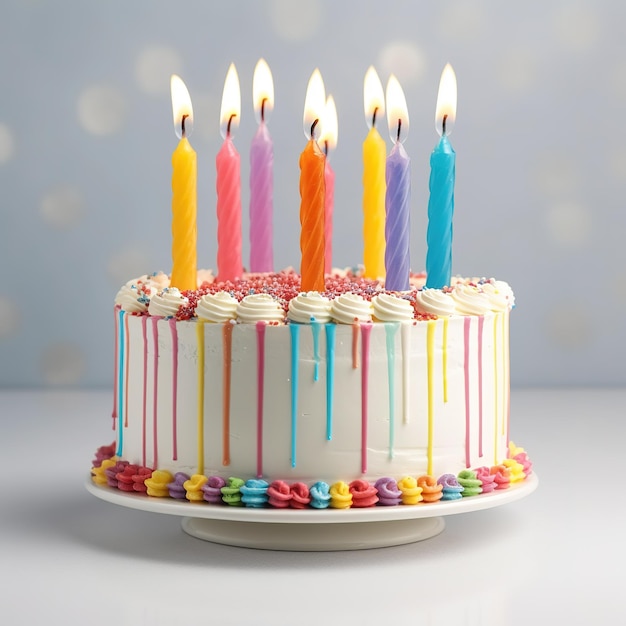
The height and width of the screenshot is (626, 626). I want to click on birthday candles, so click(183, 238), click(237, 228), click(265, 223), click(315, 237), click(327, 222), click(379, 237), click(398, 235), click(444, 228).